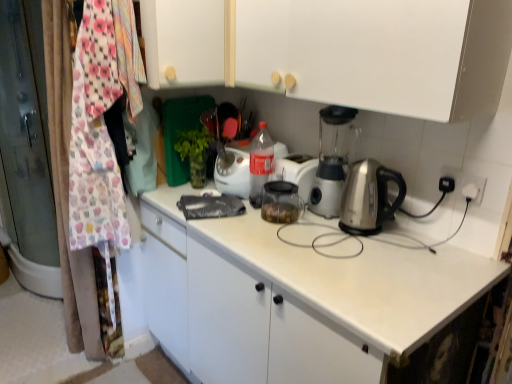
Find the location of `white matte cabinet at upper center, positioned as the 2th cabinetry in right-to-left order`. white matte cabinet at upper center, positioned as the 2th cabinetry in right-to-left order is located at coordinates (183, 41).

At what (x,y) coordinates should I click in order to perform the action: click on white matte cabinet at upper center, positioned as the 2th cabinetry in left-to-right order. Please return your answer as a coordinate pair (x, y). Image resolution: width=512 pixels, height=384 pixels. Looking at the image, I should click on (339, 50).

Is translucent plastic bottle at center surrounding white matte cabinet at upper center, positioned as the 1th cabinetry in left-to-right order?

That's incorrect, white matte cabinet at upper center, positioned as the 1th cabinetry in left-to-right order, is not inside translucent plastic bottle at center.

Find the location of a particular element. The image size is (512, 384). kitchen appliance located on the right of white matte cabinet at upper center, positioned as the 2th cabinetry in right-to-left order is located at coordinates (234, 169).

Which is nearer, [243,192] or [152,56]?

Clearly, point [243,192] is more distant from the camera than point [152,56].

Are white matte cabinet at upper center, positioned as the 2th cabinetry in left-to-right order, and white matte cabinet at upper center, positioned as the 2th cabinetry in right-to-left order, making contact?

They are not placed beside each other.

This screenshot has width=512, height=384. Identify the location of cabinetry that is on the right side of white matte cabinet at upper center, positioned as the 1th cabinetry in left-to-right order. (339, 50).

Based on the photo, from the image's perspective, is white matte cabinet at upper center, positioned as the 2th cabinetry in left-to-right order, above or below white matte cabinet at upper center, positioned as the 1th cabinetry in left-to-right order?

From the image's perspective, white matte cabinet at upper center, positioned as the 2th cabinetry in left-to-right order, appears below white matte cabinet at upper center, positioned as the 1th cabinetry in left-to-right order.

From a real-world perspective, which is physically below, white matte cabinet at upper center, positioned as the 2th cabinetry in left-to-right order, or translucent plastic bottle at center?

translucent plastic bottle at center, from a real-world perspective.

Which object is further away from the camera taking this photo, white matte cabinet at upper center, positioned as the 2th cabinetry in left-to-right order, or translucent plastic bottle at center?

translucent plastic bottle at center is more distant.

Can you confirm if white matte cabinet at upper center, positioned as the 2th cabinetry in left-to-right order, is wider than translucent plastic bottle at center?

Yes, white matte cabinet at upper center, positioned as the 2th cabinetry in left-to-right order, is wider than translucent plastic bottle at center.

Does white matte cabinet at upper center, placed as the 1th cabinetry when sorted from right to left, turn towards translucent plastic bottle at center?

No, white matte cabinet at upper center, placed as the 1th cabinetry when sorted from right to left, is not facing towards translucent plastic bottle at center.

From a real-world perspective, is translucent plastic bottle at center beneath white matte cabinet at upper center, placed as the 1th cabinetry when sorted from right to left?

Correct, in the physical world, translucent plastic bottle at center is lower than white matte cabinet at upper center, placed as the 1th cabinetry when sorted from right to left.

Is translucent plastic bottle at center directly adjacent to white matte cabinet at upper center, positioned as the 2th cabinetry in left-to-right order?

translucent plastic bottle at center is not next to white matte cabinet at upper center, positioned as the 2th cabinetry in left-to-right order, and they're not touching.

In terms of width, does translucent plastic bottle at center look wider or thinner when compared to white matte cabinet at upper center, placed as the 1th cabinetry when sorted from right to left?

Clearly, translucent plastic bottle at center has less width compared to white matte cabinet at upper center, placed as the 1th cabinetry when sorted from right to left.

Is point (240, 162) farther from viewer compared to point (218, 30)?

Yes.

In the scene shown: Based on their positions, is white matte cabinet at upper center, positioned as the 2th cabinetry in right-to-left order, located to the left or right of translucent plastic bottle at center?

In the image, white matte cabinet at upper center, positioned as the 2th cabinetry in right-to-left order, appears on the left side of translucent plastic bottle at center.

Is white matte cabinet at upper center, positioned as the 1th cabinetry in left-to-right order, facing away from translucent plastic bottle at center?

No, white matte cabinet at upper center, positioned as the 1th cabinetry in left-to-right order, is not facing the opposite direction of translucent plastic bottle at center.

From a real-world perspective, is white matte cabinet at upper center, positioned as the 2th cabinetry in right-to-left order, above or below translucent plastic bottle at center?

From a real-world perspective, white matte cabinet at upper center, positioned as the 2th cabinetry in right-to-left order, is physically above translucent plastic bottle at center.

From the image's perspective, between white matte cabinet at upper center, positioned as the 2th cabinetry in right-to-left order, and translucent plastic bottle at center, who is located below?

translucent plastic bottle at center, from the image's perspective.

Looking at this image, does white matte cabinet at upper center, positioned as the 2th cabinetry in right-to-left order, turn towards white matte cabinet at upper center, positioned as the 2th cabinetry in left-to-right order?

No, white matte cabinet at upper center, positioned as the 2th cabinetry in right-to-left order, is not turned towards white matte cabinet at upper center, positioned as the 2th cabinetry in left-to-right order.

Which is less distant, (207, 27) or (353, 59)?

The point (353, 59) is closer to the camera.

Can you tell me how much white matte cabinet at upper center, positioned as the 2th cabinetry in right-to-left order, and white matte cabinet at upper center, placed as the 1th cabinetry when sorted from right to left, differ in facing direction?

The angle between the facing direction of white matte cabinet at upper center, positioned as the 2th cabinetry in right-to-left order, and the facing direction of white matte cabinet at upper center, placed as the 1th cabinetry when sorted from right to left, is 0.0015 degrees.

From the picture: From the image's perspective, who appears lower, white matte cabinet at upper center, positioned as the 2th cabinetry in right-to-left order, or white matte cabinet at upper center, placed as the 1th cabinetry when sorted from right to left?

From the image's view, white matte cabinet at upper center, placed as the 1th cabinetry when sorted from right to left, is below.

Locate an element on the screen. This screenshot has width=512, height=384. cabinetry on the left side of translucent plastic bottle at center is located at coordinates [183, 41].

In order to click on cabinetry that appears below the white matte cabinet at upper center, positioned as the 2th cabinetry in right-to-left order (from a real-world perspective) in this screenshot , I will do tap(339, 50).

Estimate the real-world distances between objects in this image. Which object is closer to white matte cabinet at upper center, placed as the 1th cabinetry when sorted from right to left, translucent plastic bottle at center or white matte cabinet at upper center, positioned as the 2th cabinetry in right-to-left order?

white matte cabinet at upper center, positioned as the 2th cabinetry in right-to-left order, is closer to white matte cabinet at upper center, placed as the 1th cabinetry when sorted from right to left.

From the image, which object appears to be nearer to translucent plastic bottle at center, white matte cabinet at upper center, positioned as the 2th cabinetry in right-to-left order, or white matte cabinet at upper center, positioned as the 2th cabinetry in left-to-right order?

white matte cabinet at upper center, positioned as the 2th cabinetry in right-to-left order.

From the picture: Based on their spatial positions, is translucent plastic bottle at center or white matte cabinet at upper center, positioned as the 2th cabinetry in left-to-right order, closer to white matte cabinet at upper center, positioned as the 1th cabinetry in left-to-right order?

The object closer to white matte cabinet at upper center, positioned as the 1th cabinetry in left-to-right order, is white matte cabinet at upper center, positioned as the 2th cabinetry in left-to-right order.

Looking at the image, which one is located closer to white matte cabinet at upper center, placed as the 1th cabinetry when sorted from right to left, white matte cabinet at upper center, positioned as the 1th cabinetry in left-to-right order, or translucent plastic bottle at center?

The object closer to white matte cabinet at upper center, placed as the 1th cabinetry when sorted from right to left, is white matte cabinet at upper center, positioned as the 1th cabinetry in left-to-right order.

Looking at this image, when comparing their distances from white matte cabinet at upper center, positioned as the 1th cabinetry in left-to-right order, does white matte cabinet at upper center, positioned as the 2th cabinetry in left-to-right order, or translucent plastic bottle at center seem closer?

white matte cabinet at upper center, positioned as the 2th cabinetry in left-to-right order, is closer to white matte cabinet at upper center, positioned as the 1th cabinetry in left-to-right order.

From the image, which object appears to be nearer to translucent plastic bottle at center, white matte cabinet at upper center, placed as the 1th cabinetry when sorted from right to left, or white matte cabinet at upper center, positioned as the 2th cabinetry in right-to-left order?

The object closer to translucent plastic bottle at center is white matte cabinet at upper center, positioned as the 2th cabinetry in right-to-left order.

Where is `cabinetry between white matte cabinet at upper center, placed as the 1th cabinetry when sorted from right to left, and translucent plastic bottle at center, along the z-axis`? This screenshot has height=384, width=512. cabinetry between white matte cabinet at upper center, placed as the 1th cabinetry when sorted from right to left, and translucent plastic bottle at center, along the z-axis is located at coordinates (183, 41).